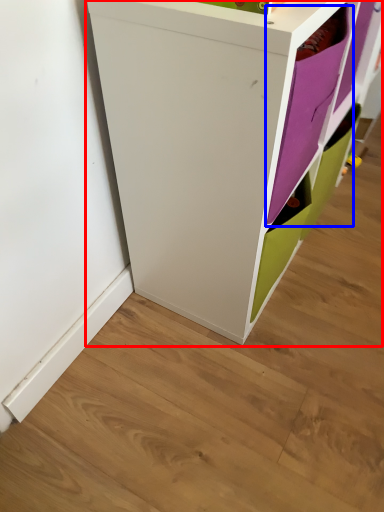
Question: Which object is further to the camera taking this photo, cupboard (highlighted by a red box) or shelf (highlighted by a blue box)?

Choices:
 (A) cupboard
 (B) shelf

Answer: (B)